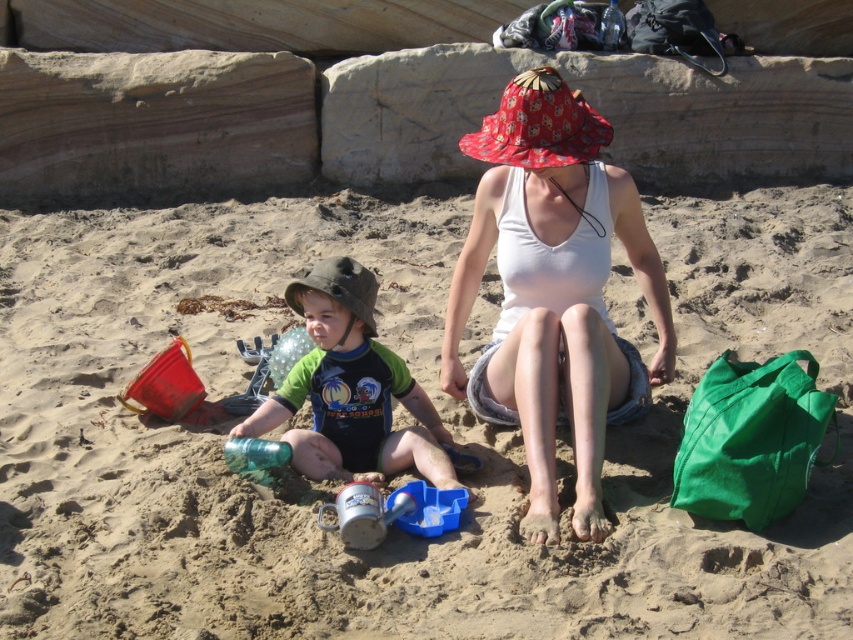
Question: Which is farther from the fine-grained sand at center?

Choices:
 (A) green matte swimsuit at left
 (B) white cotton tank top at center

Answer: (A)

Question: Among these points, which one is farthest from the camera?

Choices:
 (A) (509, 234)
 (B) (370, 460)

Answer: (B)

Question: Is the position of fine-grained sand at center more distant than that of green matte swimsuit at left?

Choices:
 (A) no
 (B) yes

Answer: (A)

Question: Is white cotton tank top at center behind green matte swimsuit at left?

Choices:
 (A) yes
 (B) no

Answer: (B)

Question: Which of the following is the closest to the observer?

Choices:
 (A) (480, 280)
 (B) (102, 460)

Answer: (A)

Question: Can you confirm if fine-grained sand at center is thinner than white cotton tank top at center?

Choices:
 (A) yes
 (B) no

Answer: (B)